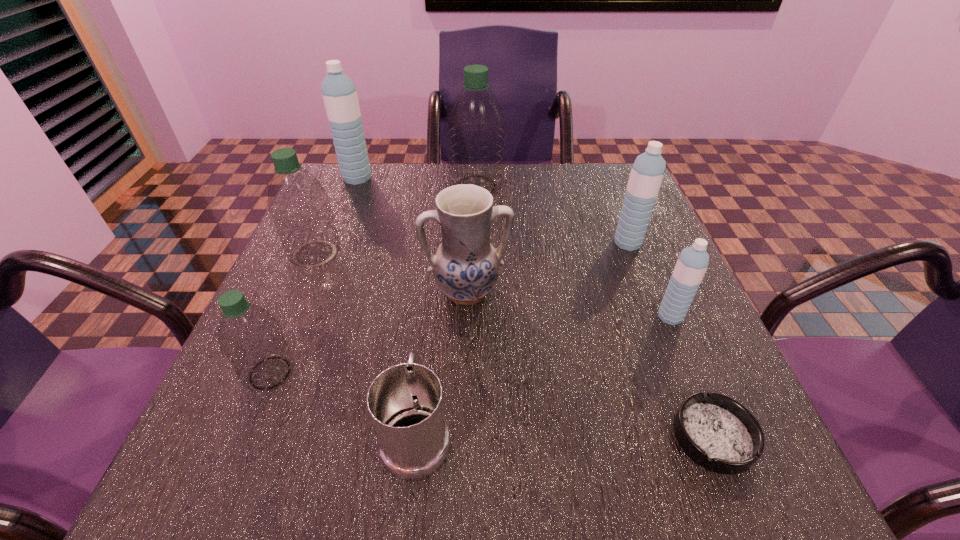
Locate an element on the screen. The image size is (960, 540). the nearest water bottle is located at coordinates (250, 338).

Locate an element on the screen. mug is located at coordinates (405, 402).

This screenshot has width=960, height=540. I want to click on gray mug, so click(x=405, y=402).

Where is `ashtray`? ashtray is located at coordinates (717, 432).

I want to click on dark ashtray, so click(x=717, y=432).

Identify the location of vacant area located 0.330m on the right of the fourth water bottle from left to right. (628, 186).

Image resolution: width=960 pixels, height=540 pixels. What are the coordinates of `vacant space located 0.050m on the right of the biggest blue water bottle` in the screenshot? It's located at (391, 178).

At what (x,y) coordinates should I click in order to perform the action: click on free region located 0.110m on the front of the second nearest green water bottle. Please return your answer as a coordinate pair (x, y). Looking at the image, I should click on (291, 309).

Locate an element on the screen. free space located on the front of the second farthest blue water bottle is located at coordinates (675, 364).

You are a GUI agent. You are given a task and a screenshot of the screen. Output one action in this format:
    pyautogui.click(x=<x>, y=<y>)
    Task: Click on the blank space located 0.210m on the back of the blue pottery
    The height and width of the screenshot is (540, 960).
    Given the screenshot: What is the action you would take?
    pyautogui.click(x=469, y=213)